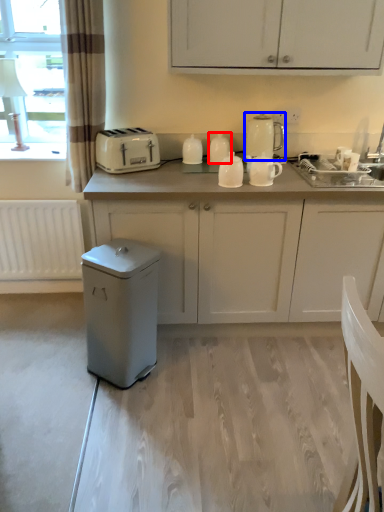
Question: Which point is further to the camera, kitchen appliance (highlighted by a red box) or kitchen appliance (highlighted by a blue box)?

Choices:
 (A) kitchen appliance
 (B) kitchen appliance

Answer: (A)